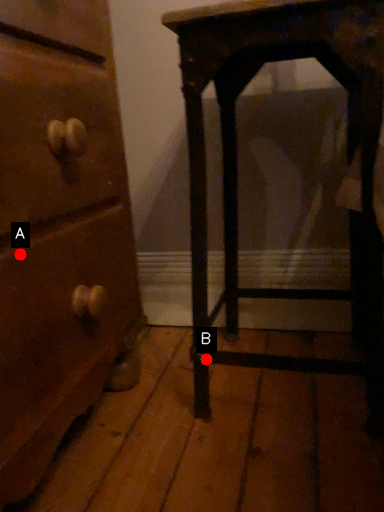
Question: Two points are circled on the image, labeled by A and B beside each circle. Which point is closer to the camera taking this photo?

Choices:
 (A) A is closer
 (B) B is closer

Answer: (A)